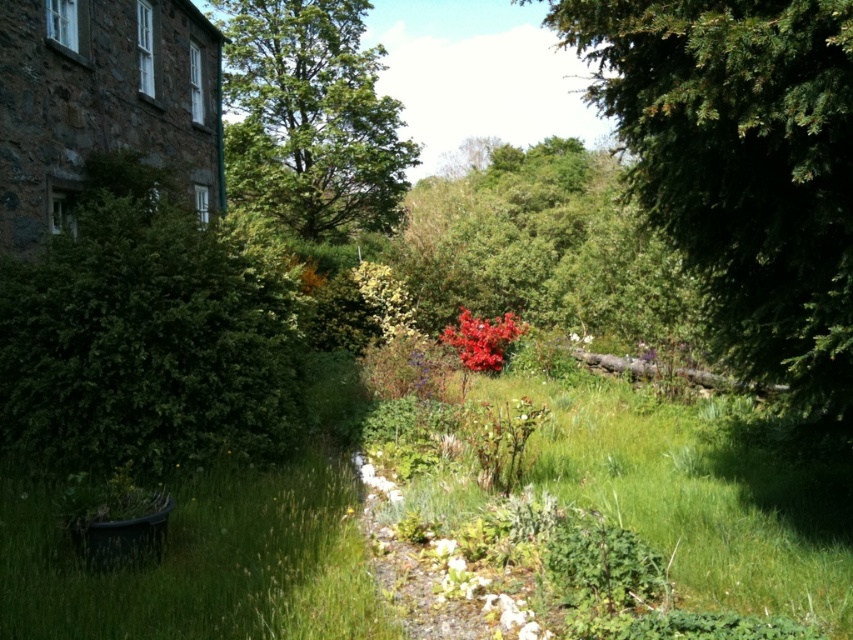
Question: Can you confirm if green needle-like at right is positioned to the right of green grass at center?

Choices:
 (A) yes
 (B) no

Answer: (A)

Question: Among these points, which one is farthest from the camera?

Choices:
 (A) (340, 596)
 (B) (770, 124)
 (C) (498, 368)

Answer: (C)

Question: Which point is farther to the camera?

Choices:
 (A) glossy red bush at center
 (B) green leafy tree at upper center
 (C) green grass at lower left
 (D) green grass at center

Answer: (B)

Question: Which of the following is the closest to the observer?

Choices:
 (A) glossy red bush at center
 (B) green needle-like at right

Answer: (B)

Question: Can you confirm if green needle-like at right is positioned to the right of green grass at center?

Choices:
 (A) no
 (B) yes

Answer: (B)

Question: Does green leafy tree at upper center have a lesser width compared to glossy red bush at center?

Choices:
 (A) no
 (B) yes

Answer: (A)